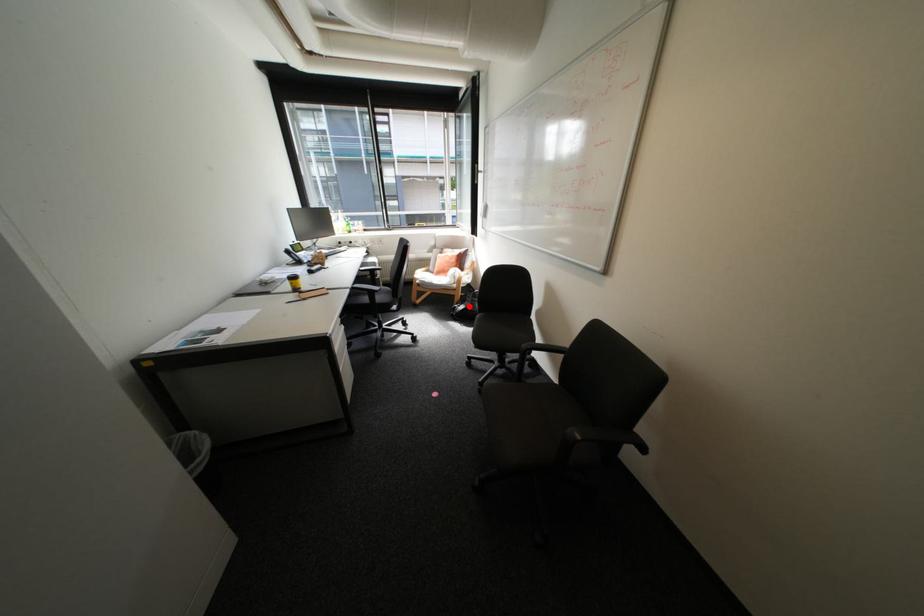
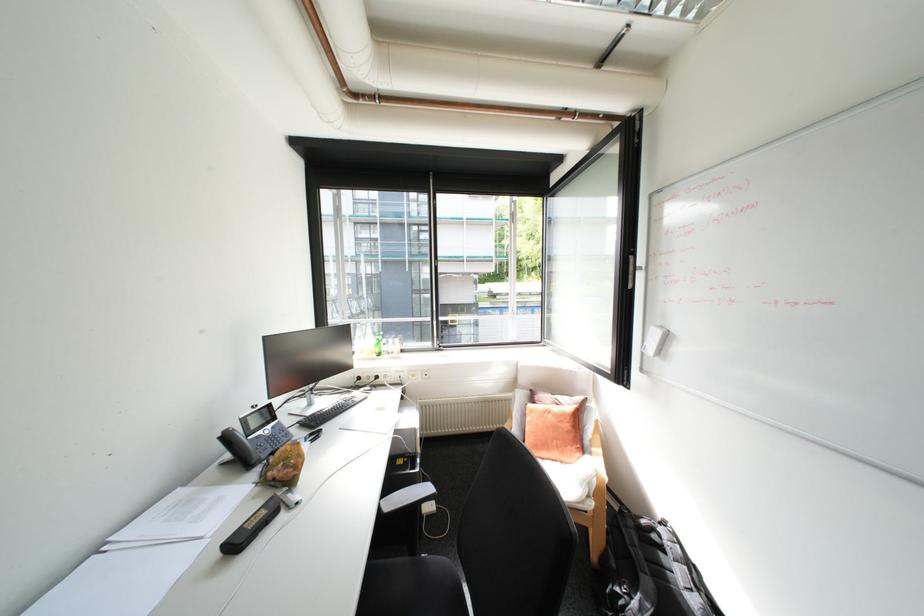
Question: I am providing you with two images of the same scene from different viewpoints. In image1, a red point is highlighted. Considering the same 3D point in image2, which of the following is correct?

Choices:
 (A) It is closer
 (B) It is farther

Answer: (A)